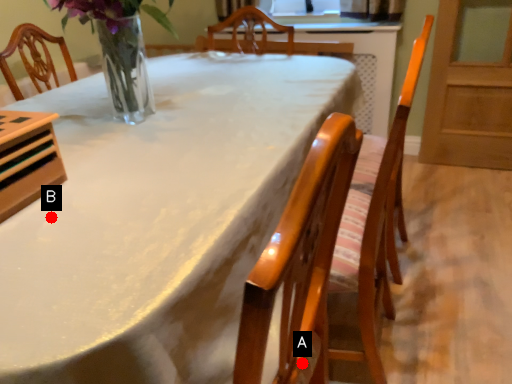
Question: Two points are circled on the image, labeled by A and B beside each circle. Which point appears farthest from the camera in this image?

Choices:
 (A) A is further
 (B) B is further

Answer: (A)